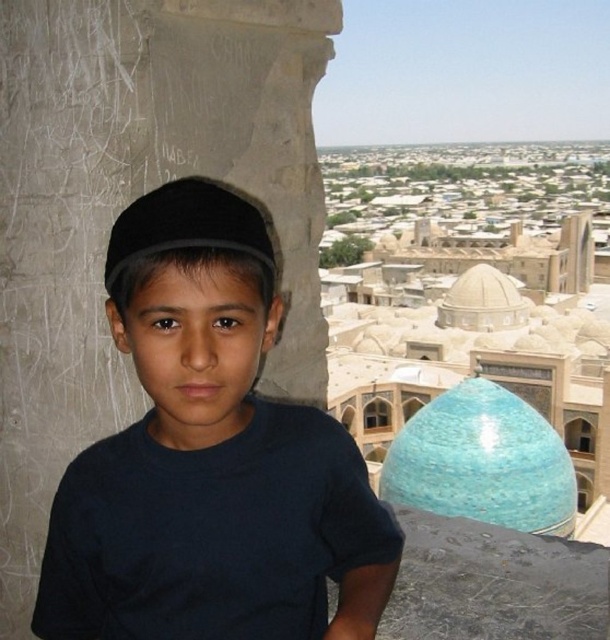
Who is shorter, dark blue t-shirt at center or black fabric baseball hat at center?

With less height is black fabric baseball hat at center.

Does dark blue t-shirt at center appear on the right side of black fabric baseball hat at center?

Yes, dark blue t-shirt at center is to the right of black fabric baseball hat at center.

Is point (198, 280) positioned before point (267, 259)?

Yes, point (198, 280) is closer to viewer.

Locate an element on the screen. The width and height of the screenshot is (610, 640). dark blue t-shirt at center is located at coordinates (209, 458).